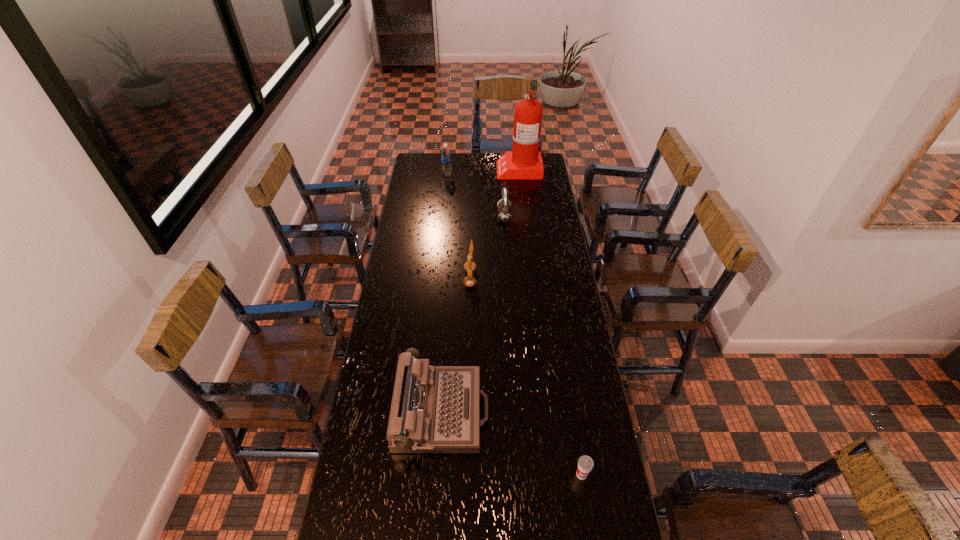
This screenshot has width=960, height=540. What are the coordinates of `the tallest object` in the screenshot? It's located at (524, 161).

I want to click on water bottle, so click(x=445, y=153).

Find the location of `the third farthest object`. the third farthest object is located at coordinates (504, 215).

You are a GUI agent. You are given a task and a screenshot of the screen. Output one action in this format:
    pyautogui.click(x=<x>, y=<y>)
    Task: Click on the farther earphone
    The height and width of the screenshot is (540, 960).
    Given the screenshot: What is the action you would take?
    pyautogui.click(x=504, y=215)

At what (x,y) coordinates should I click in order to perform the action: click on the fourth farthest object. Please return your answer as a coordinate pair (x, y). This screenshot has width=960, height=540. Looking at the image, I should click on (469, 281).

Locate an element on the screen. the left earphone is located at coordinates 469,281.

Image resolution: width=960 pixels, height=540 pixels. In order to click on typewriter in this screenshot , I will do `click(435, 409)`.

Where is `the nearest object`? the nearest object is located at coordinates (585, 464).

At what (x,y) coordinates should I click in order to perform the action: click on cup. Please return your answer as a coordinate pair (x, y). The height and width of the screenshot is (540, 960). Looking at the image, I should click on (585, 464).

Where is `vacant space located on the front-facing side of the fire extinguisher`? vacant space located on the front-facing side of the fire extinguisher is located at coordinates pyautogui.click(x=474, y=168).